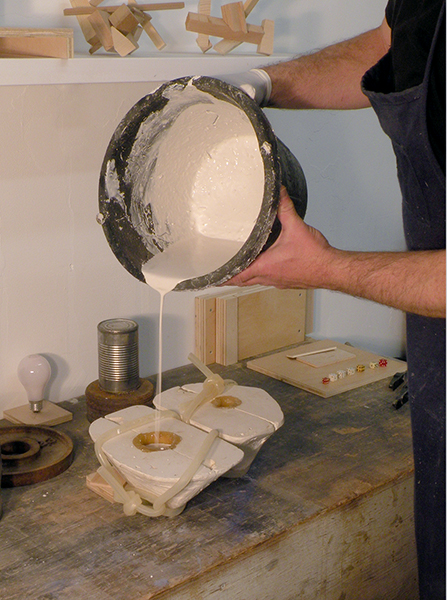
Where is `holes in plaster mold`? The height and width of the screenshot is (600, 447). holes in plaster mold is located at coordinates (162, 442), (224, 403).